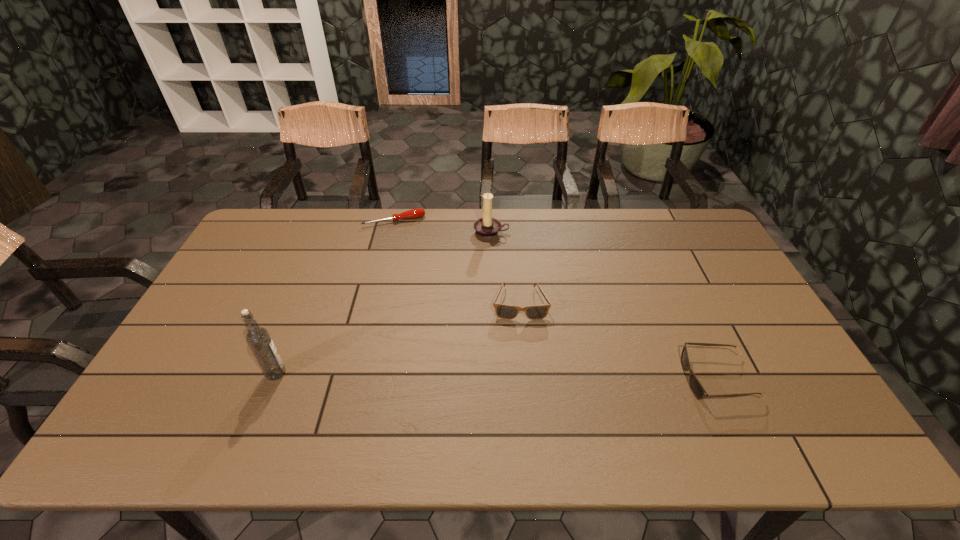
Locate an element on the screen. This screenshot has height=540, width=960. vacant space located on the lenses of the fourth tallest object is located at coordinates (614, 379).

Where is `free space located 0.070m on the lenses of the fourth tallest object`? This screenshot has height=540, width=960. free space located 0.070m on the lenses of the fourth tallest object is located at coordinates (658, 379).

Image resolution: width=960 pixels, height=540 pixels. I want to click on vacant space located 0.160m on the lenses of the fourth tallest object, so click(x=623, y=379).

Image resolution: width=960 pixels, height=540 pixels. What are the coordinates of `free point located 0.150m at the tip of the shortest object` in the screenshot? It's located at pyautogui.click(x=411, y=253).

The width and height of the screenshot is (960, 540). What are the coordinates of `vacant position located 0.360m at the tip of the shortest object` in the screenshot? It's located at (424, 294).

Locate an element on the screen. The width and height of the screenshot is (960, 540). vacant space located 0.330m at the tip of the shortest object is located at coordinates (422, 288).

At what (x,y) coordinates should I click in order to perform the action: click on free space located 0.140m on the wick of the fourth shortest object. Please return your answer as a coordinate pair (x, y). This screenshot has width=960, height=540. Looking at the image, I should click on (484, 267).

This screenshot has width=960, height=540. Identify the location of vacant space located 0.210m on the wick of the fourth shortest object. (481, 281).

The height and width of the screenshot is (540, 960). Identify the location of blank space located on the wick of the fourth shortest object. (487, 253).

Image resolution: width=960 pixels, height=540 pixels. What are the coordinates of `free region located on the frames of the farther sunglasses` in the screenshot? It's located at (525, 393).